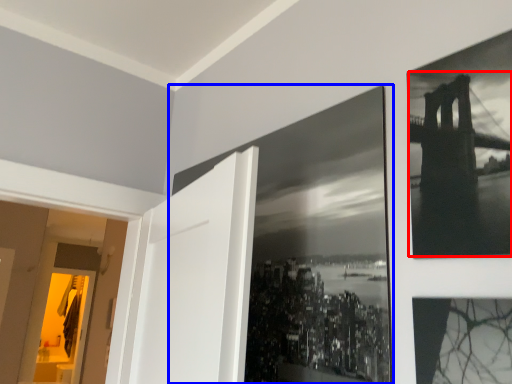
Question: Which point is further to the camera, Golden Gate Bridge (highlighted by a red box) or picture frame (highlighted by a blue box)?

Choices:
 (A) Golden Gate Bridge
 (B) picture frame

Answer: (B)